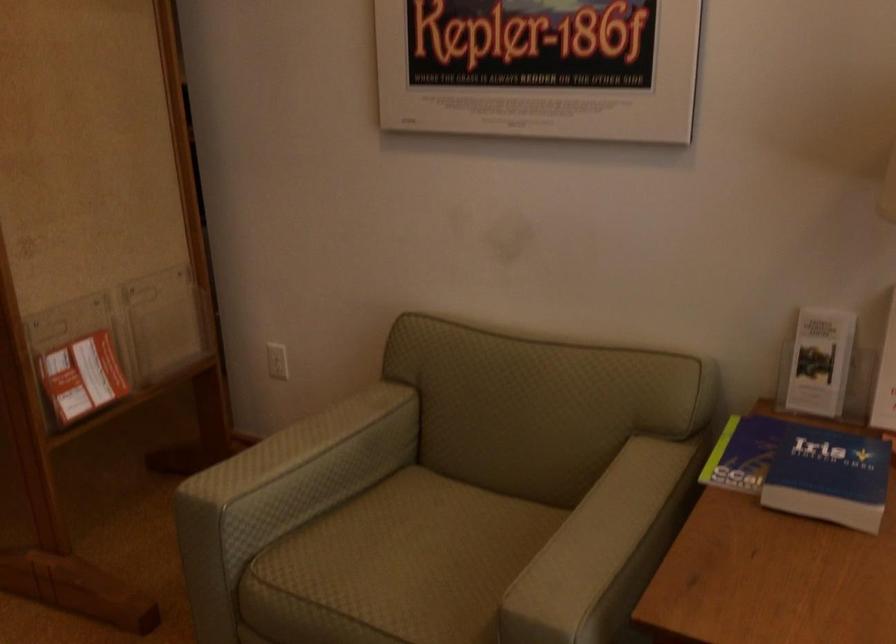
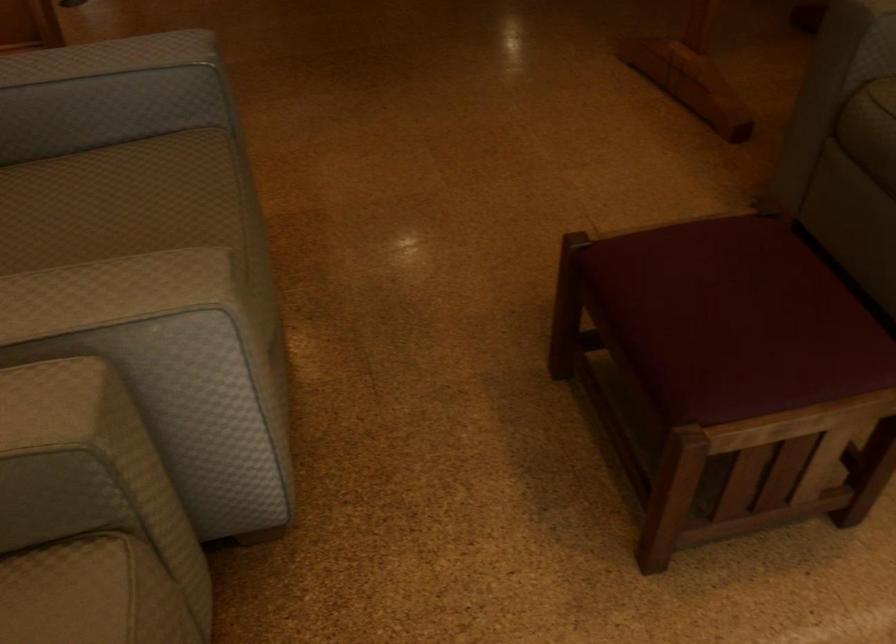
First-person continuous shooting, in which direction is the camera rotating?

The rotation direction of the camera is left-down.